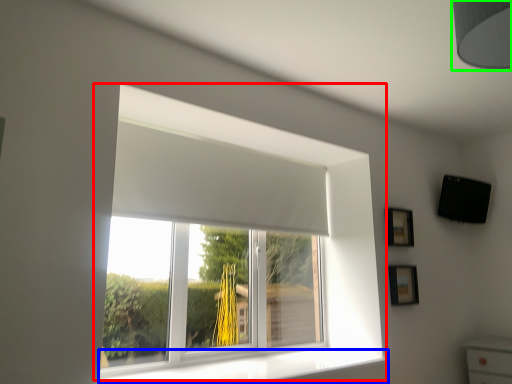
Question: Considering the real-world distances, which object is farthest from window (highlighted by a red box)? window sill (highlighted by a blue box) or lamp (highlighted by a green box)?

Choices:
 (A) window sill
 (B) lamp

Answer: (B)